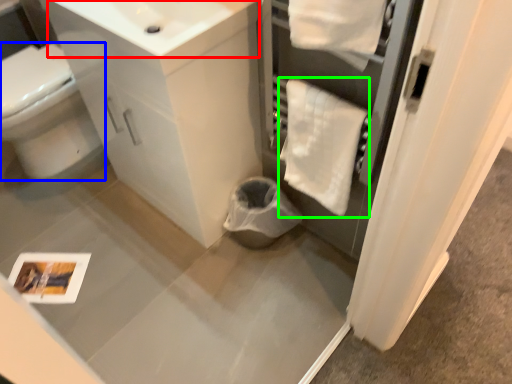
Question: Which object is the closest to the sink (highlighted by a red box)? Choose among these: bidet (highlighted by a blue box) or bath towel (highlighted by a green box).

Choices:
 (A) bidet
 (B) bath towel

Answer: (B)